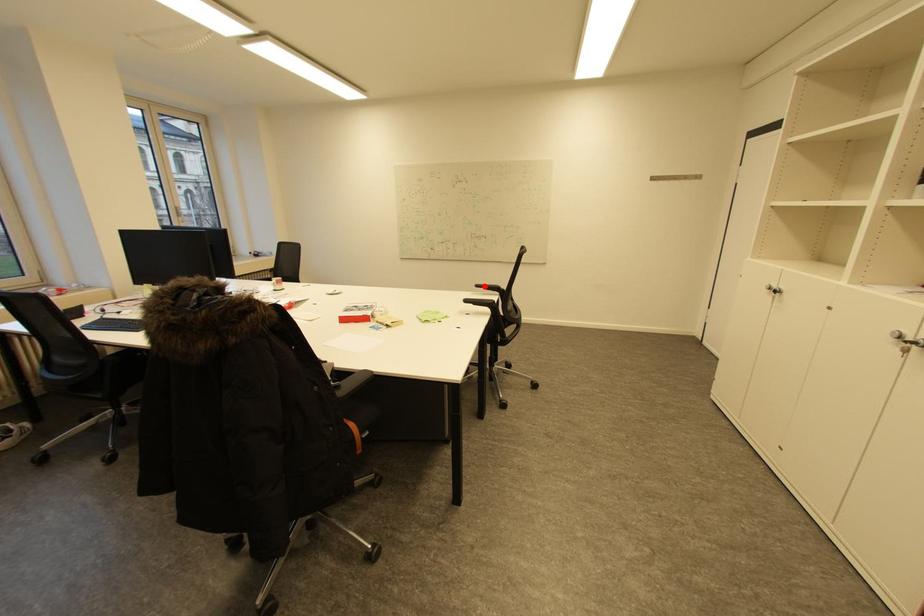
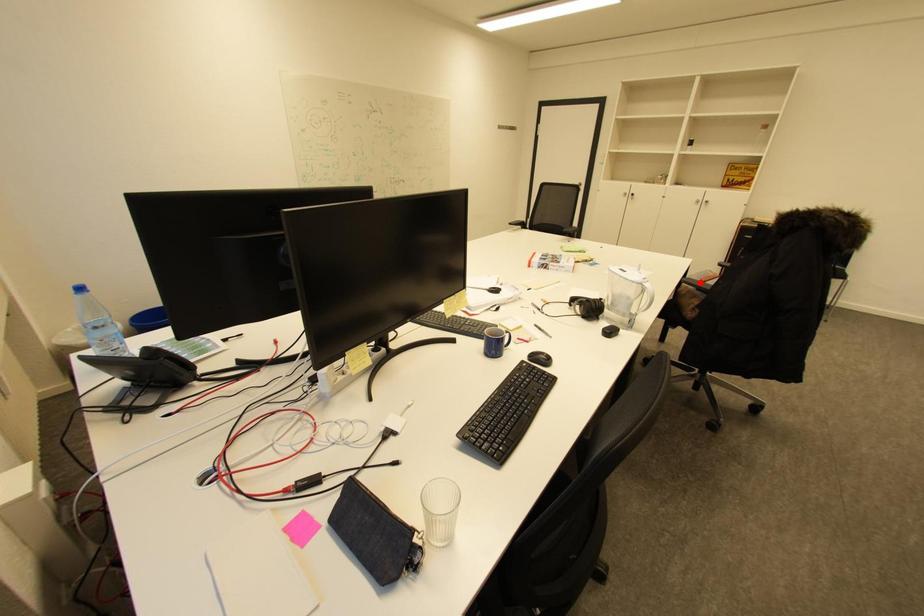
I am providing you with two images of the same scene from different viewpoints. A red point is marked on the first image and another point is marked on the second image. Is the marked point in image1 the same physical position as the marked point in image2?

No